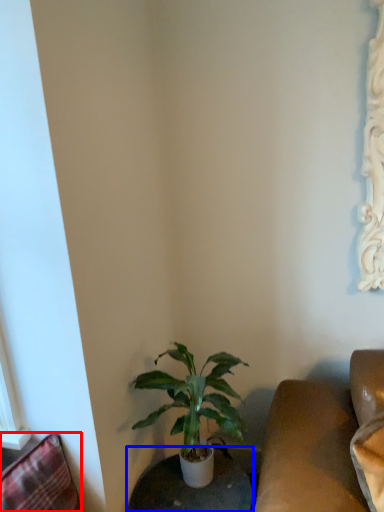
Question: Which object is closer to the camera taking this photo, swivel chair (highlighted by a red box) or round table (highlighted by a blue box)?

Choices:
 (A) swivel chair
 (B) round table

Answer: (A)